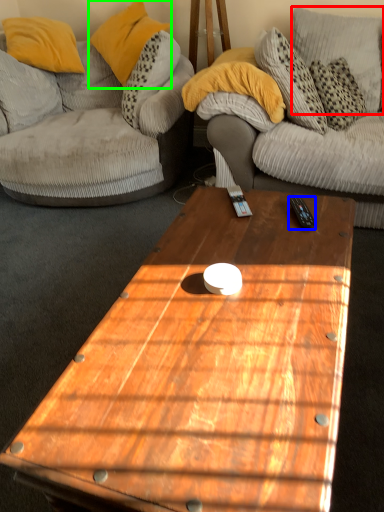
Question: Estimate the real-world distances between objects in this image. Which object is farther from pillow (highlighted by a red box), remote control (highlighted by a blue box) or pillow (highlighted by a green box)?

Choices:
 (A) remote control
 (B) pillow

Answer: (A)